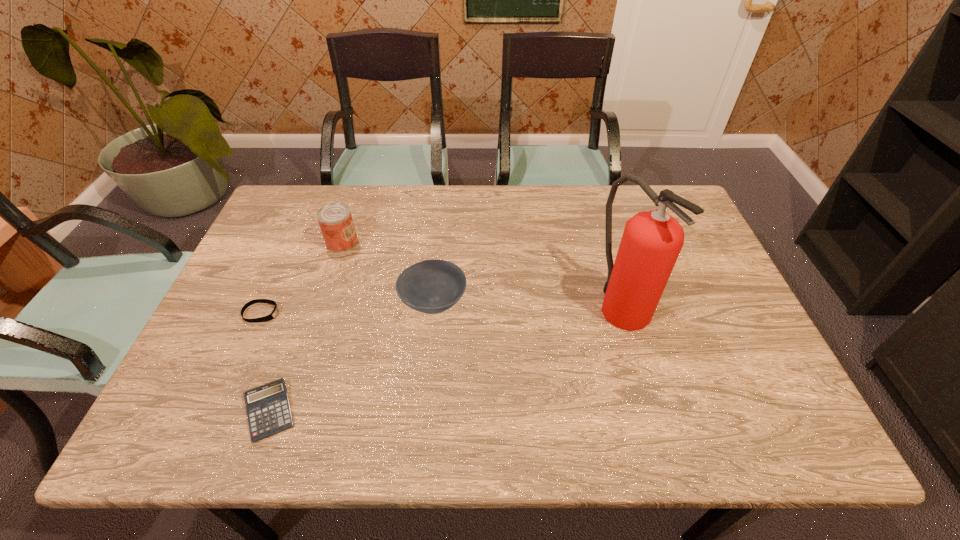
The image size is (960, 540). Identify the location of the rightmost object. (651, 242).

This screenshot has height=540, width=960. In order to click on fire extinguisher in this screenshot , I will do `click(651, 242)`.

This screenshot has width=960, height=540. What are the coordinates of `the farthest object` in the screenshot? It's located at (335, 219).

The height and width of the screenshot is (540, 960). Find the location of `the second tallest object`. the second tallest object is located at coordinates point(335,219).

In order to click on the second object from right to left in this screenshot , I will do `click(432, 286)`.

At what (x,y) coordinates should I click in order to perform the action: click on bowl. Please return your answer as a coordinate pair (x, y). This screenshot has height=540, width=960. Looking at the image, I should click on (432, 286).

In order to click on the leftmost object in this screenshot , I will do `click(271, 316)`.

Identify the location of calculator. The width and height of the screenshot is (960, 540). (268, 409).

Locate an element on the screen. free space located on the handle side of the rightmost object is located at coordinates (646, 384).

Find the location of `free space located on the left of the second tallest object`. free space located on the left of the second tallest object is located at coordinates (306, 242).